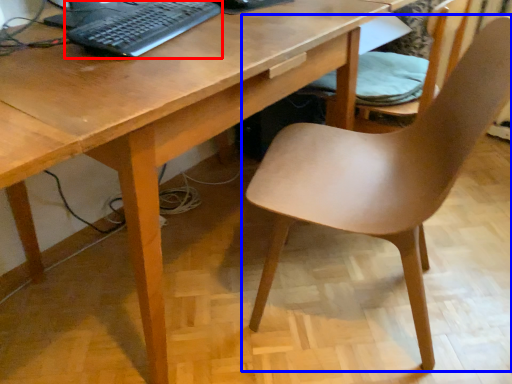
Question: Among these objects, which one is nearest to the camera, computer keyboard (highlighted by a red box) or chair (highlighted by a blue box)?

Choices:
 (A) computer keyboard
 (B) chair

Answer: (B)